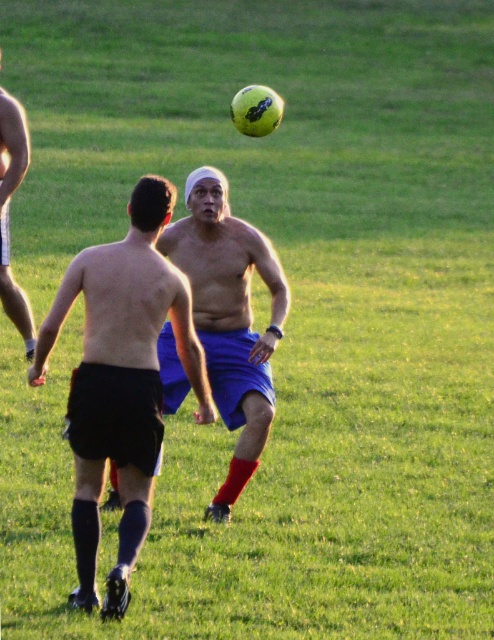
Is point (81, 496) behind point (17, 180)?

No.

Does shiny blue shorts at center appear on the right side of shiny black shorts at left?

Yes, shiny blue shorts at center is to the right of shiny black shorts at left.

The image size is (494, 640). I want to click on shiny blue shorts at center, so click(122, 380).

Identify the location of shiny blue shorts at center. (122, 380).

Is shiny blue shorts at center thinner than blue fabric shorts at center?

No, shiny blue shorts at center is not thinner than blue fabric shorts at center.

Does shiny blue shorts at center come behind blue fabric shorts at center?

That is False.

Which is behind, point (101, 276) or point (252, 369)?

Point (252, 369)

Find the location of a particular element. This screenshot has width=494, height=640. shiny blue shorts at center is located at coordinates (122, 380).

Measure the distance between blue fabric shorts at center and camera.

The distance of blue fabric shorts at center from camera is 9.10 meters.

Is point (204, 180) positioned in front of point (18, 323)?

Yes, point (204, 180) is closer to viewer.

Image resolution: width=494 pixels, height=640 pixels. I want to click on blue fabric shorts at center, so click(x=230, y=317).